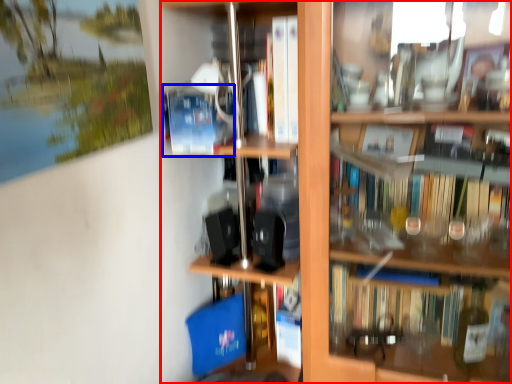
Question: Which of the following is the farthest to the observer, shelf (highlighted by a red box) or paperback book (highlighted by a blue box)?

Choices:
 (A) shelf
 (B) paperback book

Answer: (B)